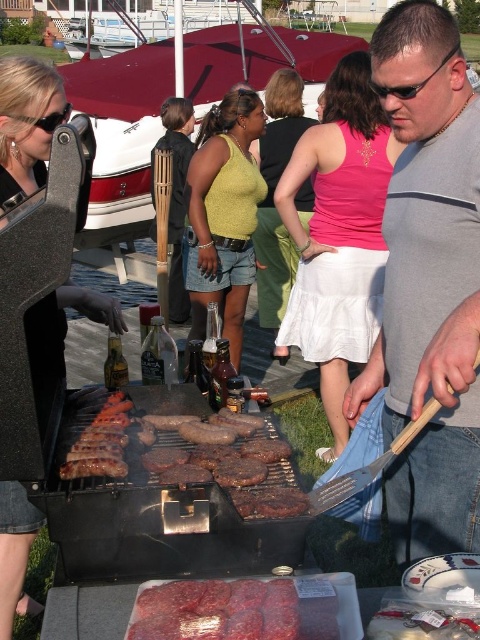
Question: Can you confirm if pink fabric skirt at center is positioned below brown charred meat at center?

Choices:
 (A) no
 (B) yes

Answer: (A)

Question: Estimate the real-world distances between objects in this image. Which object is farther from the matte black grill at left?

Choices:
 (A) brown charred meat at center
 (B) gray cotton shirt at center
 (C) dark red raw meat at center

Answer: (B)

Question: Is brown charred meat at center below green knit tank top at center?

Choices:
 (A) no
 (B) yes

Answer: (B)

Question: Among these points, which one is farthest from the camera?

Choices:
 (A) (425, 170)
 (B) (188, 129)
 (C) (7, 588)

Answer: (B)

Question: Which of the following is the farthest from the observer?

Choices:
 (A) (286, 232)
 (B) (3, 147)

Answer: (A)

Question: Does gray cotton shirt at center have a smaller size compared to dark red raw meat at center?

Choices:
 (A) yes
 (B) no

Answer: (B)